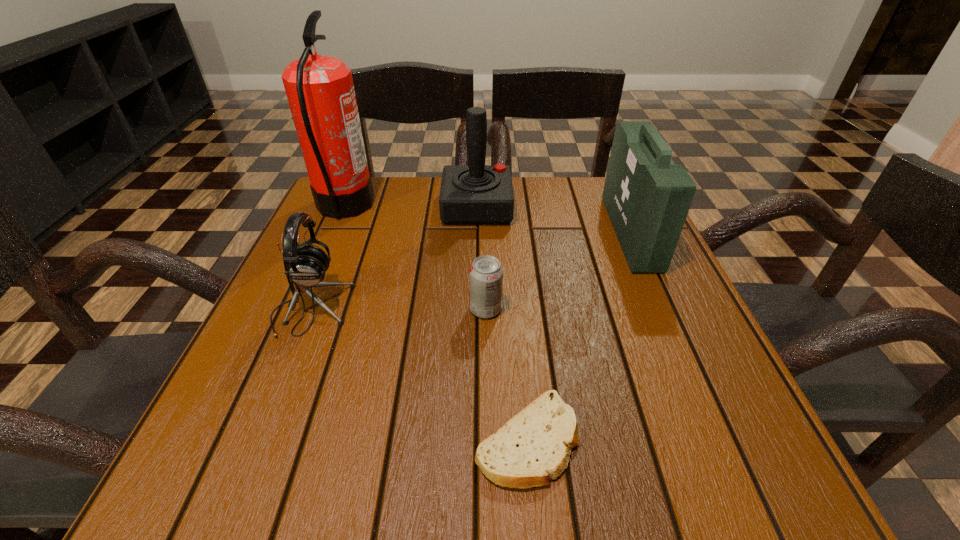
In the image, there is a desktop. Where is `vacant space at the far right corner`? vacant space at the far right corner is located at coordinates (604, 225).

Where is `free space at the near right corner`? This screenshot has width=960, height=540. free space at the near right corner is located at coordinates (741, 488).

Find the location of a particular element. free area in between the first-aid kit and the soda can is located at coordinates (558, 271).

Locate an element on the screen. The image size is (960, 540). vacant space that's between the nearest object and the joystick is located at coordinates (502, 324).

Locate an element on the screen. This screenshot has height=540, width=960. empty space between the fifth tallest object and the shortest object is located at coordinates (506, 375).

The height and width of the screenshot is (540, 960). Find the location of `free space that is in between the soda can and the pita bread`. free space that is in between the soda can and the pita bread is located at coordinates (506, 375).

Locate an element on the screen. This screenshot has width=960, height=540. blank region between the joystick and the tallest object is located at coordinates (411, 207).

Identify the location of object that can be found as the fifth closest to the fire extinguisher. This screenshot has width=960, height=540. (647, 197).

Find the location of a particular element. The image size is (960, 540). object that is the fourth closest to the tallest object is located at coordinates (534, 446).

Find the location of a particular element. blank space that satisfies the following two spatial constraints: 1. on the base of the soda can; 2. on the right side of the joystick is located at coordinates (476, 309).